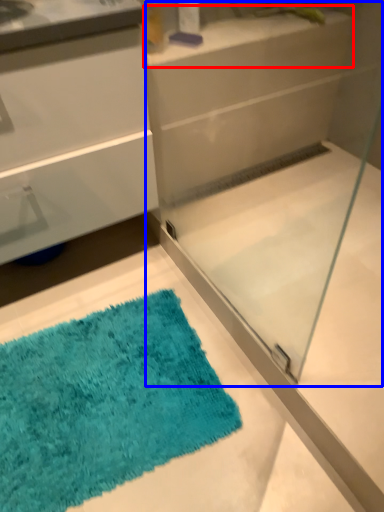
Question: Which object is closer to the camera taking this photo, counter top (highlighted by a red box) or glass box (highlighted by a blue box)?

Choices:
 (A) counter top
 (B) glass box

Answer: (B)